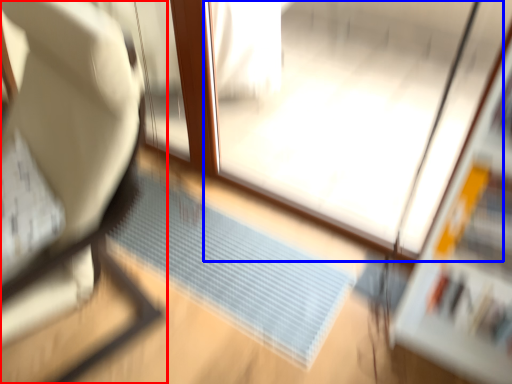
Question: Which of the following is the closest to the observer, furniture (highlighted by a red box) or screen door (highlighted by a blue box)?

Choices:
 (A) furniture
 (B) screen door

Answer: (A)